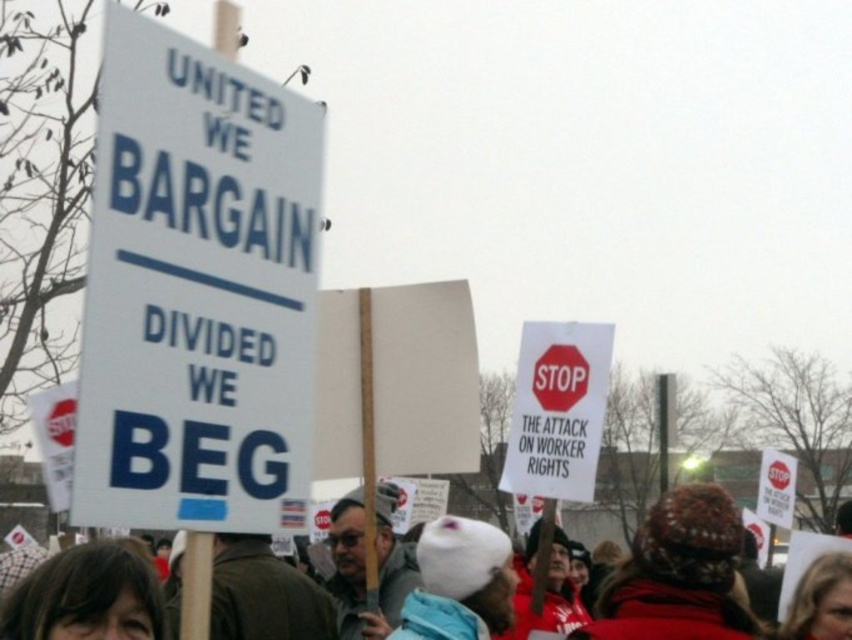
Question: Considering the relative positions of white paper sign at upper left and white paper sign at center in the image provided, where is white paper sign at upper left located with respect to white paper sign at center?

Choices:
 (A) below
 (B) above

Answer: (B)

Question: Is white paper sign at upper left bigger than white wool hat at center?

Choices:
 (A) yes
 (B) no

Answer: (B)

Question: Among these points, which one is nearest to the camera?

Choices:
 (A) (583, 374)
 (B) (797, 595)
 (C) (199, 204)
 (D) (519, 445)

Answer: (C)

Question: Can you confirm if white paper sign at upper left is smaller than white paper sign at center?

Choices:
 (A) yes
 (B) no

Answer: (A)

Question: Which object appears farthest from the camera in this image?

Choices:
 (A) white paper sign at center
 (B) white wool hat at center
 (C) red matte stop sign at upper center
 (D) white paper sign at upper left

Answer: (C)

Question: Considering the real-world distances, which object is farthest from the red matte stop sign at upper center?

Choices:
 (A) white wool hat at center
 (B) white paper sign at upper left

Answer: (B)